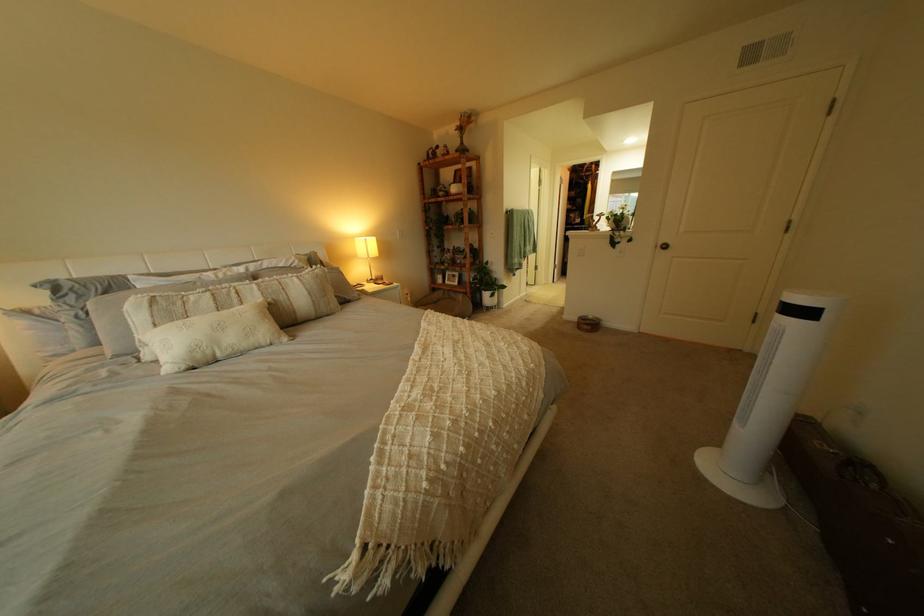
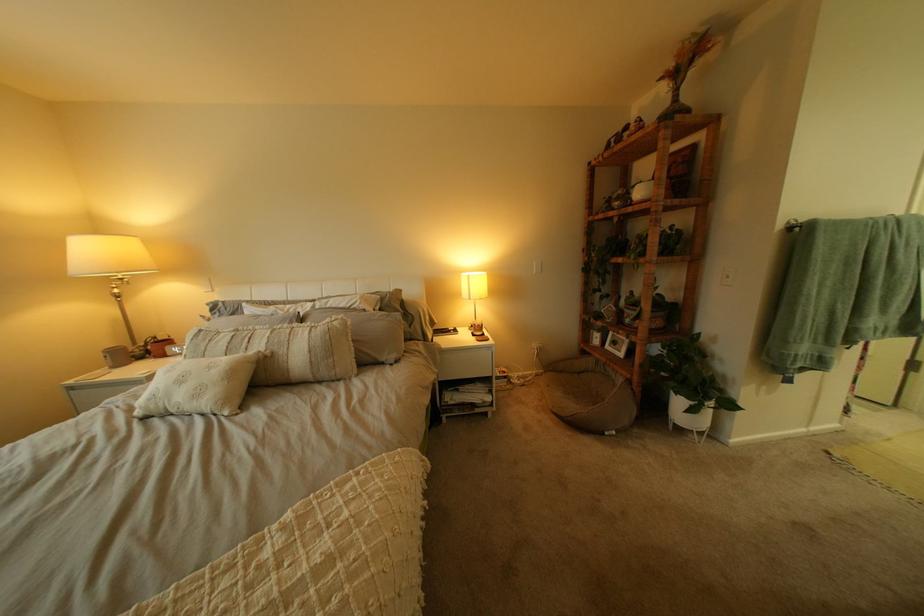
In the second image, find the point that corresponds to (x=499, y=288) in the first image.

(687, 385)